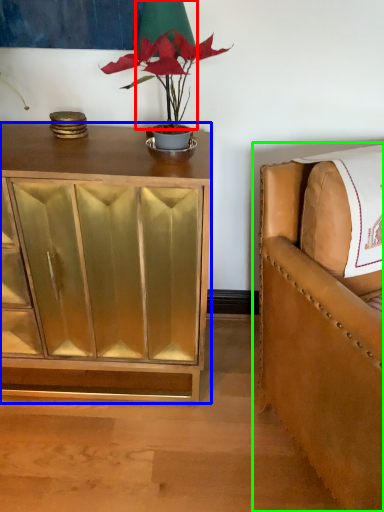
Question: Which object is the closest to the table lamp (highlighted by a red box)? Choose among these: cabinetry (highlighted by a blue box) or chair (highlighted by a green box).

Choices:
 (A) cabinetry
 (B) chair

Answer: (A)